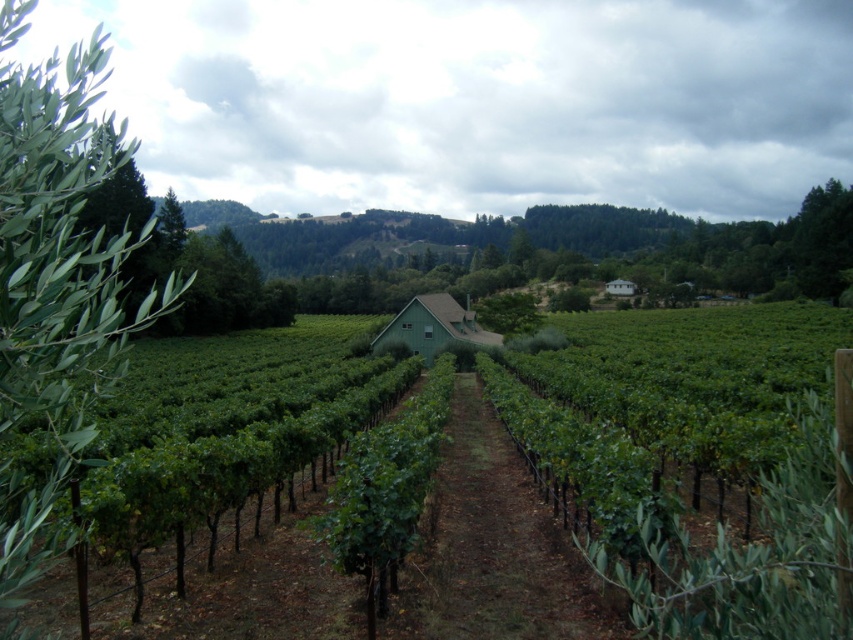
Question: Can you confirm if green matte vineyard at center is positioned to the left of green leafy tree at left?

Choices:
 (A) yes
 (B) no

Answer: (B)

Question: Which point is closer to the camera?

Choices:
 (A) (51, 538)
 (B) (241, 604)

Answer: (A)

Question: Is the position of green matte vineyard at center less distant than that of green leafy tree at left?

Choices:
 (A) yes
 (B) no

Answer: (B)

Question: Which object is closer to the camera taking this photo?

Choices:
 (A) green leafy tree at left
 (B) green matte vineyard at center

Answer: (A)

Question: Which point is farther to the camera?

Choices:
 (A) (1, 289)
 (B) (782, 374)

Answer: (B)

Question: Can you confirm if green matte vineyard at center is thinner than green leafy tree at left?

Choices:
 (A) no
 (B) yes

Answer: (A)